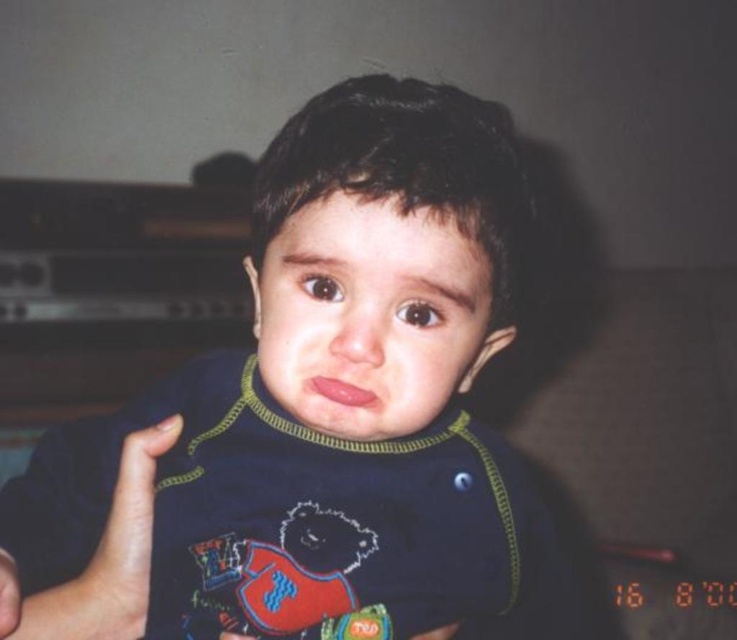
This screenshot has width=737, height=640. What do you see at coordinates (326, 419) in the screenshot? I see `dark blue fabric at center` at bounding box center [326, 419].

The image size is (737, 640). What do you see at coordinates (326, 419) in the screenshot?
I see `dark blue fabric at center` at bounding box center [326, 419].

Locate an element on the screen. This screenshot has width=737, height=640. dark blue fabric at center is located at coordinates (x=326, y=419).